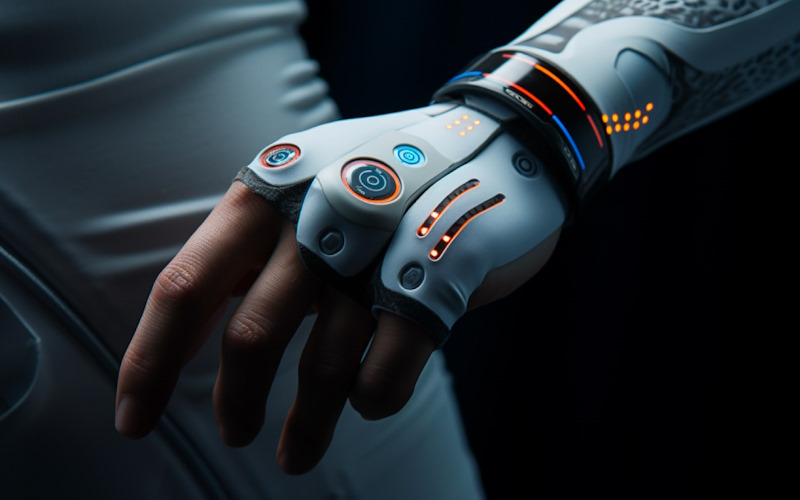
In order to click on row of round lights in this screenshot , I will do `click(468, 129)`, `click(458, 119)`.